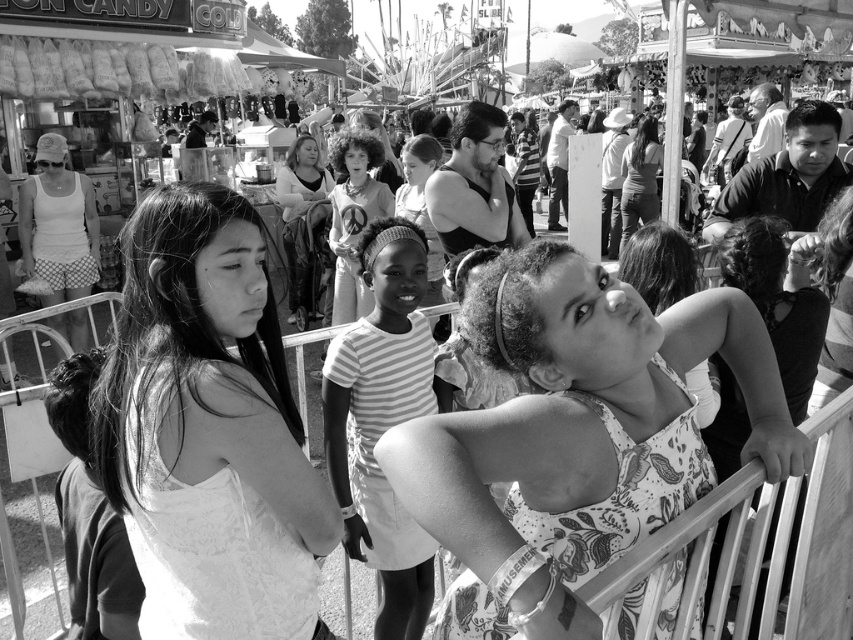
Is striped fabric dress at center taller than matte gray tank top at upper center?

In fact, striped fabric dress at center may be shorter than matte gray tank top at upper center.

Can you confirm if striped fabric dress at center is thinner than matte gray tank top at upper center?

Yes, striped fabric dress at center is thinner than matte gray tank top at upper center.

Which is in front, point (387, 557) or point (636, 156)?

Point (387, 557)

Locate an element on the screen. striped fabric dress at center is located at coordinates (383, 419).

Is floral print tank top at center shorter than white lace dress at center?

Yes, floral print tank top at center is shorter than white lace dress at center.

Is floral print tank top at center taller than white lace dress at center?

No.

Does point (657, 320) come in front of point (225, 365)?

That is False.

You are a GUI agent. You are given a task and a screenshot of the screen. Output one action in this format:
    pyautogui.click(x=<x>, y=<y>)
    Task: Click on the floral print tank top at center
    The width and height of the screenshot is (853, 640).
    Given the screenshot: What is the action you would take?
    pyautogui.click(x=576, y=436)

How much distance is there between floral print tank top at center and striped fabric dress at center?

floral print tank top at center and striped fabric dress at center are 5.21 feet apart from each other.

Who is taller, floral print tank top at center or striped fabric dress at center?

striped fabric dress at center

Where is `floral print tank top at center`? This screenshot has width=853, height=640. floral print tank top at center is located at coordinates 576,436.